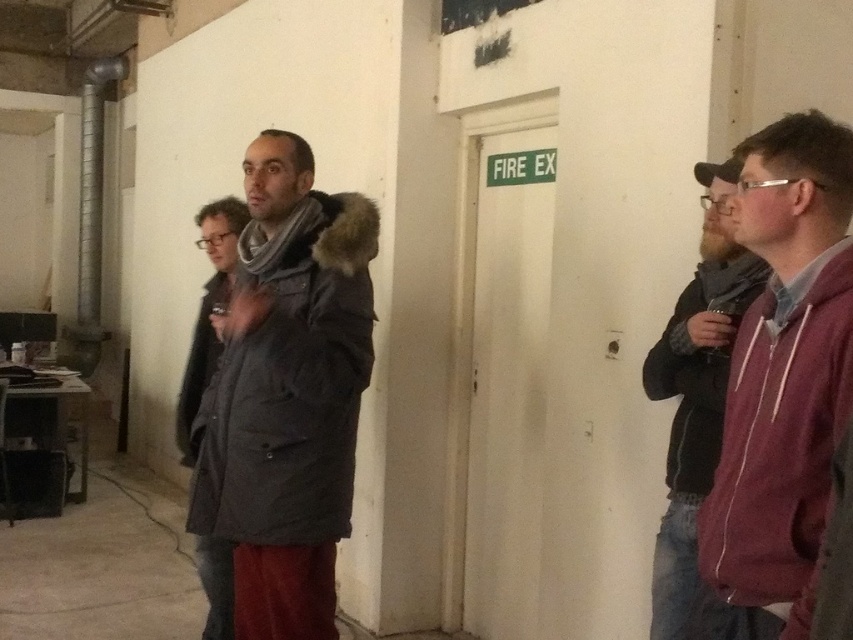
You are a photographer trying to capture a clear shot of the dark gray wool coat at center without the maroon fleece jacket at right blocking it. What should you do?

Move to the left side of the scene so that the dark gray wool coat at center is no longer behind the maroon fleece jacket at right.